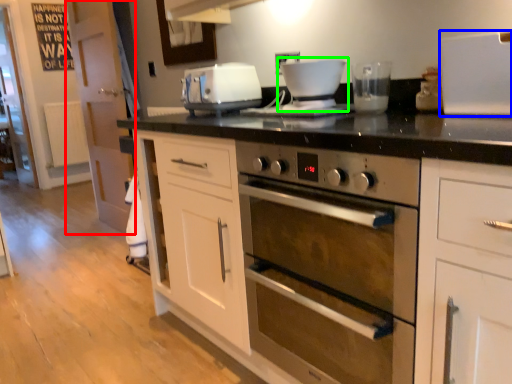
Question: Based on their relative distances, which object is farther from glass door (highlighted by a red box)? Choose from appliance (highlighted by a blue box) and coffee machine (highlighted by a green box).

Choices:
 (A) appliance
 (B) coffee machine

Answer: (A)